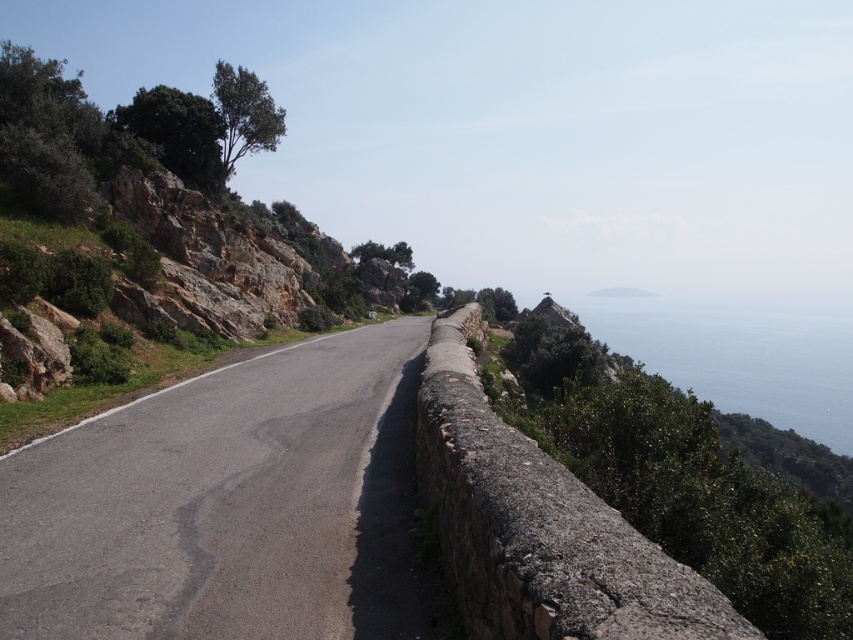
You are a hiker planning to cross from the asphalt road at center to the blue water at upper right. Based on the distance provided, can you estimate how long it would take to walk there at a moderate pace?

The asphalt road at center is 857.58 feet away from blue water at upper right. At a moderate walking pace of about 3 feet per second, it would take approximately 286 seconds, which is roughly 4 minutes and 46 seconds.

You are driving a delivery truck that is 2.5 meters wide. You are on the asphalt road at center and need to turn towards the blue water at upper right. Can your truck safely make the turn without going off the road?

The asphalt road at center has a lesser width compared to blue water at upper right. Since the road is narrower than the blue water area, and the truck is 2.5 meters wide, the truck should be able to safely make the turn as the road width is sufficient for the truck.